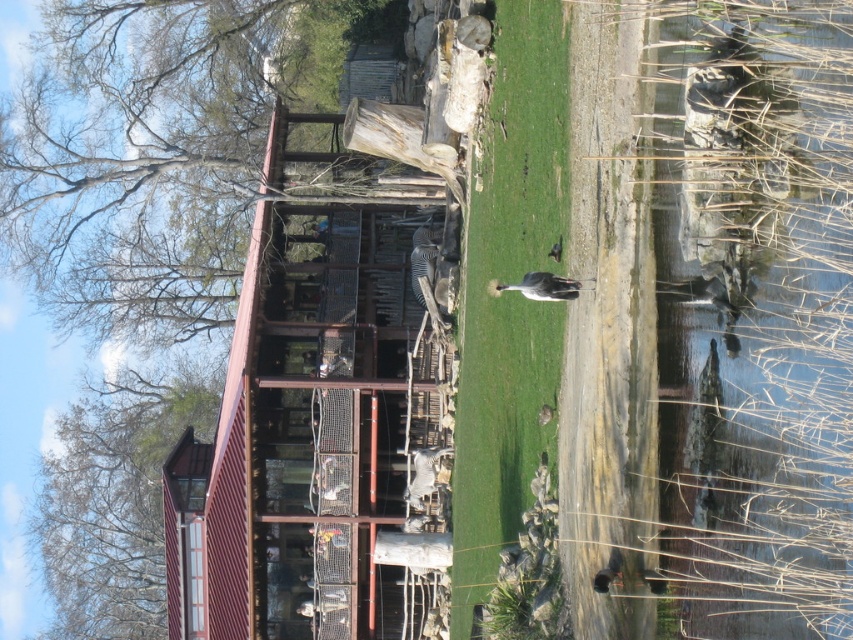
Between bare wood tree at upper left and gray feathered bird at center, which one is positioned higher?

gray feathered bird at center

Is bare wood tree at upper left shorter than gray feathered bird at center?

In fact, bare wood tree at upper left may be taller than gray feathered bird at center.

Is point (167, 436) behind point (532, 273)?

Yes, it is behind point (532, 273).

This screenshot has width=853, height=640. In order to click on bare wood tree at upper left in this screenshot , I will do `click(115, 497)`.

Does gray feathered bird at center appear over brown feathered bird at center?

Incorrect, gray feathered bird at center is not positioned above brown feathered bird at center.

Who is higher up, gray feathered bird at center or brown feathered bird at center?

Positioned higher is brown feathered bird at center.

Where is `gray feathered bird at center`? The height and width of the screenshot is (640, 853). gray feathered bird at center is located at coordinates pos(540,285).

Who is shorter, green grass at center or gray feathered bird at center?

gray feathered bird at center

Between point (538, 150) and point (566, 285), which one is positioned behind?

The point (538, 150) is more distant.

Identify the location of green grass at center. (508, 296).